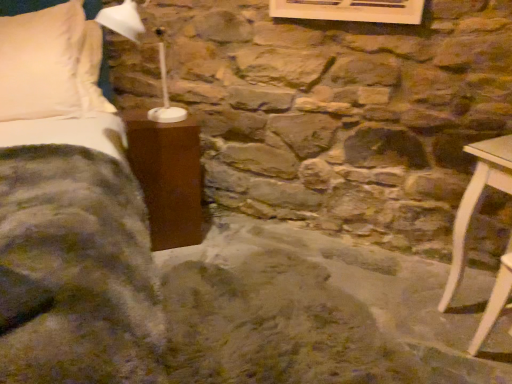
Question: Is matte brown nightstand at left, the second furniture in the right-to-left sequence, to the right of white plastic table lamp at upper left from the viewer's perspective?

Choices:
 (A) yes
 (B) no

Answer: (B)

Question: From the image's perspective, is matte brown nightstand at left, positioned as the second furniture in front-to-back order, under white plastic table lamp at upper left?

Choices:
 (A) yes
 (B) no

Answer: (A)

Question: Can you confirm if matte brown nightstand at left, positioned as the second furniture in front-to-back order, is smaller than white plastic table lamp at upper left?

Choices:
 (A) yes
 (B) no

Answer: (B)

Question: Is matte brown nightstand at left, the 1th furniture when ordered from left to right, in contact with white plastic table lamp at upper left?

Choices:
 (A) no
 (B) yes

Answer: (A)

Question: Can you confirm if matte brown nightstand at left, positioned as the second furniture in front-to-back order, is shorter than white plastic table lamp at upper left?

Choices:
 (A) no
 (B) yes

Answer: (A)

Question: Is matte brown nightstand at left, which appears as the 1th furniture when viewed from the back, not within white plastic table lamp at upper left?

Choices:
 (A) yes
 (B) no

Answer: (A)

Question: Could you tell me if white plastic table lamp at upper left is facing matte brown nightstand at left, the 1th furniture when ordered from left to right?

Choices:
 (A) yes
 (B) no

Answer: (B)

Question: From a real-world perspective, is white plastic table lamp at upper left under matte brown nightstand at left, the 1th furniture when ordered from left to right?

Choices:
 (A) yes
 (B) no

Answer: (B)

Question: Is white plastic table lamp at upper left facing away from matte brown nightstand at left, the second furniture in the right-to-left sequence?

Choices:
 (A) yes
 (B) no

Answer: (B)

Question: Can you confirm if white plastic table lamp at upper left is taller than matte brown nightstand at left, which is counted as the first furniture, starting from the top?

Choices:
 (A) no
 (B) yes

Answer: (A)

Question: Is white plastic table lamp at upper left far from matte brown nightstand at left, positioned as the second furniture in front-to-back order?

Choices:
 (A) yes
 (B) no

Answer: (B)

Question: Does white plastic table lamp at upper left come in front of matte brown nightstand at left, the second furniture in the right-to-left sequence?

Choices:
 (A) yes
 (B) no

Answer: (A)

Question: Is velvet green blanket at left facing away from white plastic table lamp at upper left?

Choices:
 (A) no
 (B) yes

Answer: (A)